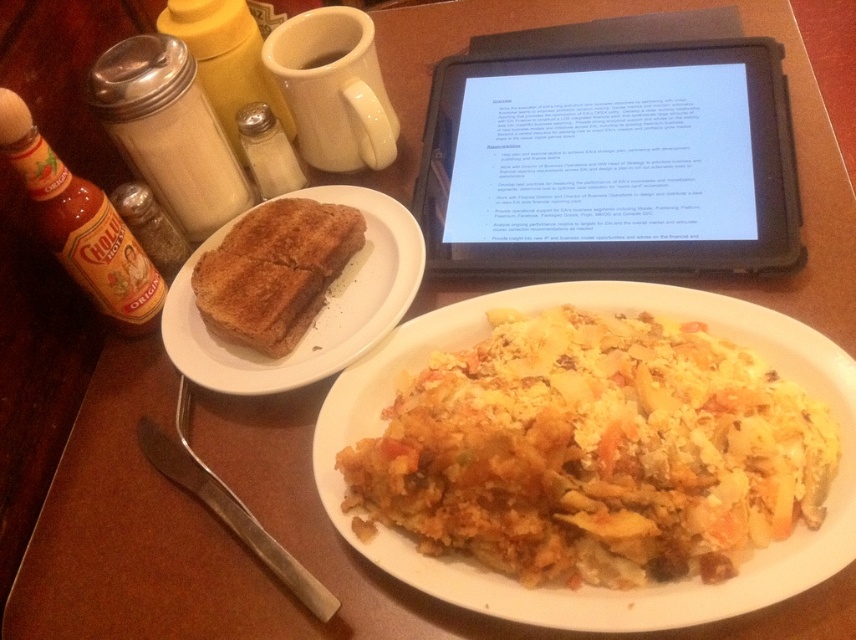
You are sitting at the wooden table and want to reach for the black plastic tablet at upper center without moving the brown toasted bread at left. Is the tablet positioned in a way that allows you to reach it without disturbing the bread?

The black plastic tablet at upper center is to the right of the brown toasted bread at left, so you can reach it without moving the bread since it is positioned to the right side of the bread.

You are a food critic sitting at the wooden table and want to describe the main dish. What is the main dish located at point (593,452)?

The main dish located at point (593,452) is the yellow cheesy pasta at center.

You are sitting at the wooden table and want to reach for the black plastic tablet at upper center. However, there is a brown toasted bread at left in your way. Can you move the tablet without touching the bread?

The black plastic tablet at upper center is located above the brown toasted bread at left, so you can move the tablet without touching the bread since it is positioned higher.